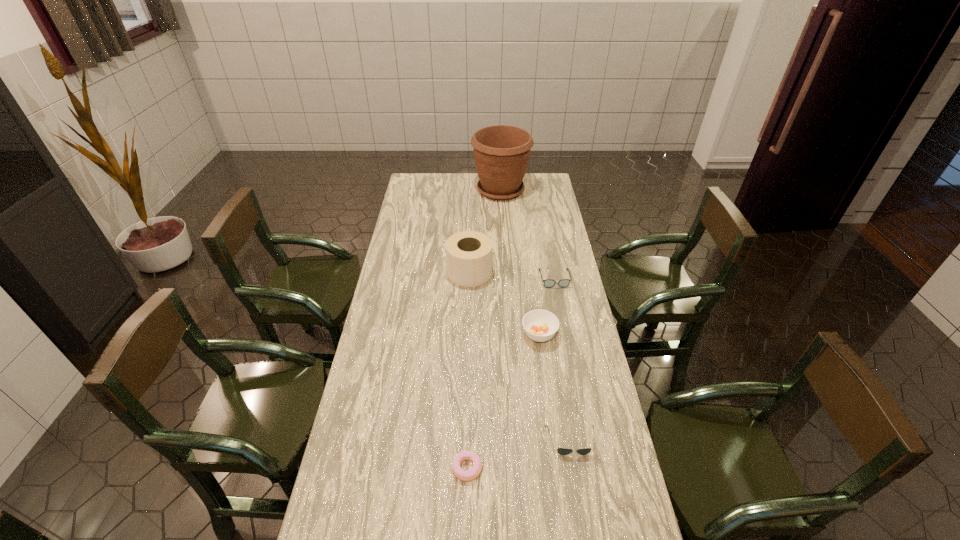
Identify the location of blank space located 0.090m on the left of the third tallest object. The image size is (960, 540). (496, 335).

Find the location of a particular element. free location located 0.180m on the face of the spectacles is located at coordinates (563, 320).

The height and width of the screenshot is (540, 960). I want to click on vacant area situated on the lenses of the sunglasses, so click(582, 503).

Where is `free space located on the left of the doughnut`? free space located on the left of the doughnut is located at coordinates (338, 468).

The image size is (960, 540). I want to click on object situated at the far edge, so click(x=501, y=153).

I want to click on flowerpot at the right edge, so click(x=501, y=153).

Image resolution: width=960 pixels, height=540 pixels. In order to click on soup bowl located at the right edge in this screenshot , I will do `click(539, 325)`.

Identify the location of spectacles that is at the right edge. The height and width of the screenshot is (540, 960). (548, 283).

This screenshot has height=540, width=960. Find the location of `sunglasses located at the right edge`. sunglasses located at the right edge is located at coordinates (562, 451).

The width and height of the screenshot is (960, 540). What are the coordinates of `object present at the far right corner` in the screenshot? It's located at (501, 153).